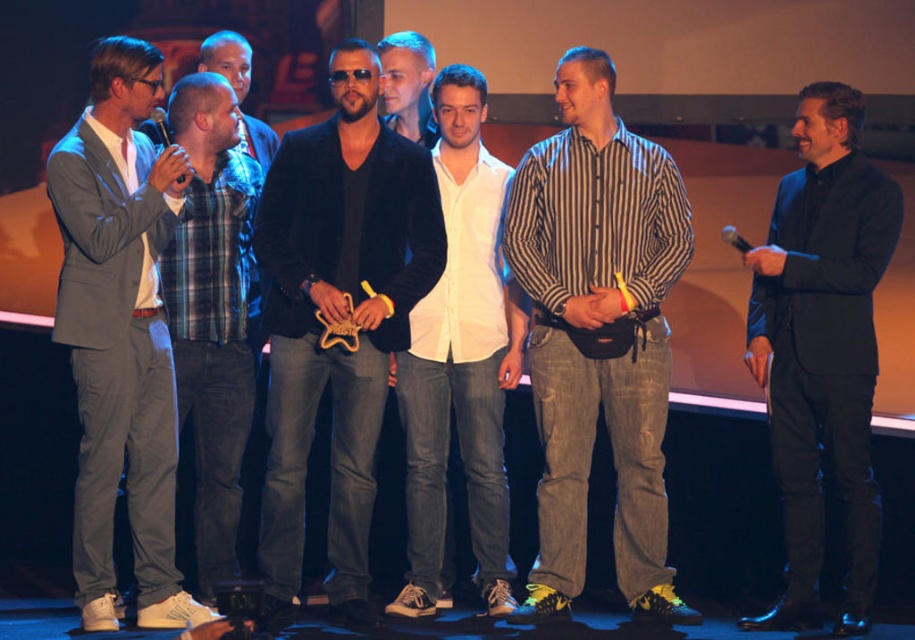
Question: Which point appears closest to the camera in this image?

Choices:
 (A) (475, 280)
 (B) (856, 259)
 (C) (571, 499)
 (D) (157, 627)

Answer: (D)

Question: Is gray suit at left smaller than plaid shirt at left?

Choices:
 (A) no
 (B) yes

Answer: (A)

Question: Which point is farther from the camera taking this photo?

Choices:
 (A) (443, 173)
 (B) (227, 358)
 (C) (119, 164)
 (D) (849, 92)

Answer: (A)

Question: Is gray suit at left positioned in front of black shiny suit at right?

Choices:
 (A) yes
 (B) no

Answer: (A)

Question: Considering the real-world distances, which object is farthest from the black shiny suit at right?

Choices:
 (A) striped cotton shirt at center
 (B) velvet black jacket at center
 (C) plaid shirt at left
 (D) gray suit at left

Answer: (D)

Question: Where is black shiny suit at right located in relation to plaid shirt at left in the image?

Choices:
 (A) left
 (B) right

Answer: (B)